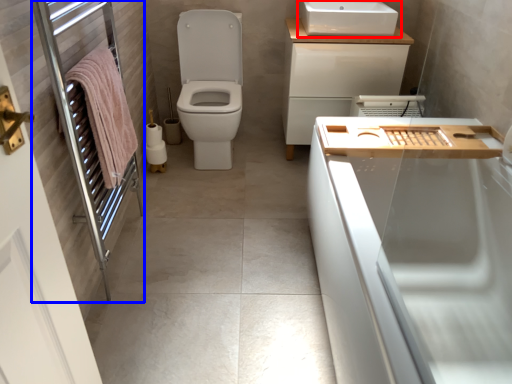
Question: Among these objects, which one is nearest to the camera, sink (highlighted by a red box) or screen door (highlighted by a blue box)?

Choices:
 (A) sink
 (B) screen door

Answer: (B)